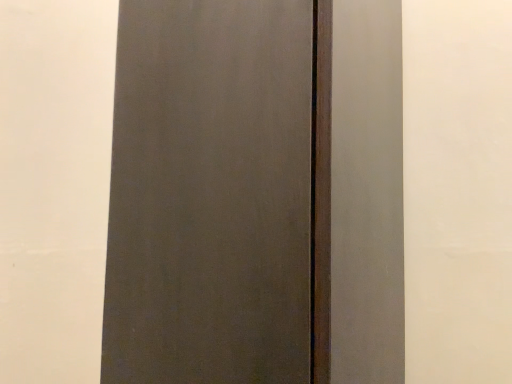
What is the approximate height of matte black door at center?

matte black door at center is 33.38 inches in height.

The image size is (512, 384). What are the coordinates of `matte black door at center` in the screenshot? It's located at tap(212, 194).

This screenshot has width=512, height=384. Describe the element at coordinates (212, 194) in the screenshot. I see `matte black door at center` at that location.

I want to click on matte black door at center, so click(x=212, y=194).